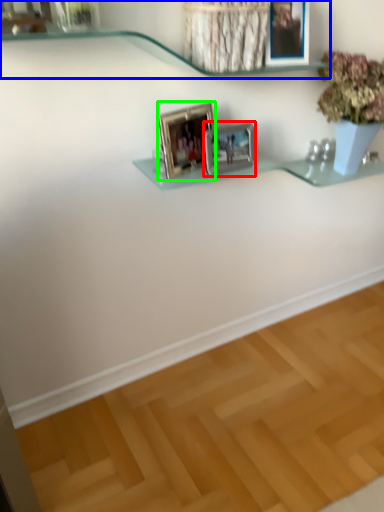
Question: Which is nearer to the picture frame (highlighted by a red box)? shelf (highlighted by a blue box) or picture frame (highlighted by a green box).

Choices:
 (A) shelf
 (B) picture frame

Answer: (B)